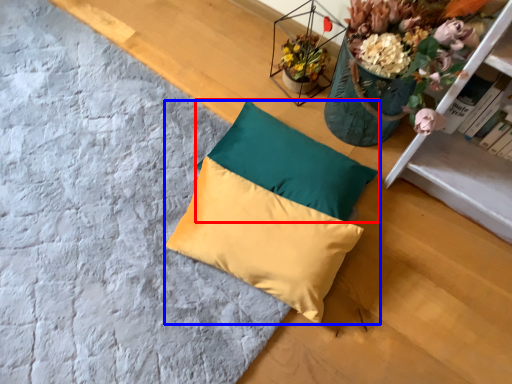
Question: Which of the following is the closest to the observer, pillow (highlighted by a red box) or pillow (highlighted by a blue box)?

Choices:
 (A) pillow
 (B) pillow

Answer: (B)